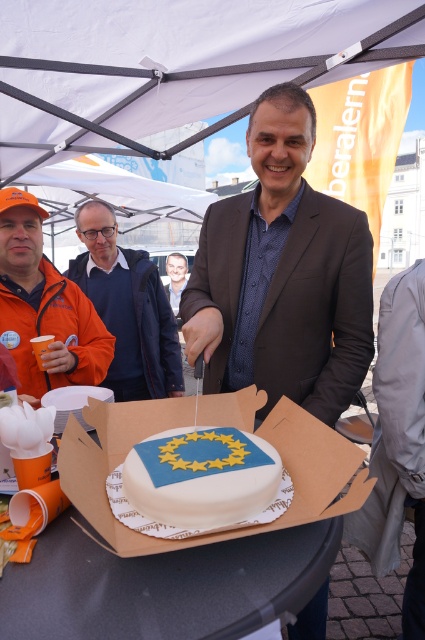
Which is more to the left, orange fabric jacket at upper left or smooth gray suit at center?

From the viewer's perspective, orange fabric jacket at upper left appears more on the left side.

In the scene shown: Can you confirm if orange fabric jacket at upper left is positioned to the left of smooth gray suit at center?

Yes, orange fabric jacket at upper left is to the left of smooth gray suit at center.

Between point (25, 250) and point (180, 276), which one is positioned behind?

Point (180, 276)

Where is `orange fabric jacket at upper left`? The image size is (425, 640). orange fabric jacket at upper left is located at coordinates (44, 307).

Can you confirm if matte brown suit at center is taller than smooth gray suit at center?

Correct, matte brown suit at center is much taller as smooth gray suit at center.

Is matte brown suit at center further to the viewer compared to smooth gray suit at center?

No, matte brown suit at center is in front of smooth gray suit at center.

Is point (220, 308) farther from viewer compared to point (170, 285)?

No, it is in front of (170, 285).

I want to click on matte brown suit at center, so click(x=282, y=275).

Does orange fabric jacket at upper left have a smaller size compared to blue fabric jacket at center?

→ Indeed, orange fabric jacket at upper left has a smaller size compared to blue fabric jacket at center.

Can you confirm if orange fabric jacket at upper left is bigger than blue fabric jacket at center?

No.

Who is more distant from viewer, (36, 218) or (166, 324)?

Point (166, 324)

The width and height of the screenshot is (425, 640). I want to click on orange fabric jacket at upper left, so click(44, 307).